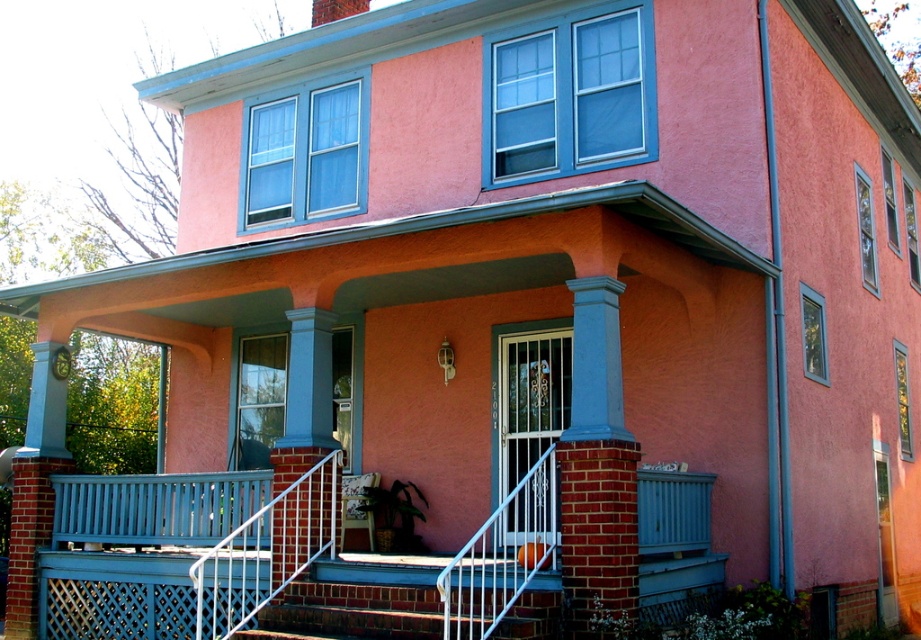
Who is positioned more to the left, blue painted brick column at center or white metal railing at center?

From the viewer's perspective, white metal railing at center appears more on the left side.

Can you confirm if blue painted brick column at center is taller than white metal railing at center?

Yes.

Is point (626, 547) closer to viewer compared to point (461, 604)?

No, (626, 547) is behind (461, 604).

You are a GUI agent. You are given a task and a screenshot of the screen. Output one action in this format:
    pyautogui.click(x=<x>, y=<y>)
    Task: Click on the blue painted brick column at center
    
    Given the screenshot: What is the action you would take?
    pyautogui.click(x=596, y=467)

Can you confirm if white metal railing at center is taller than brick stairs at center?

Indeed, white metal railing at center has a greater height compared to brick stairs at center.

Is white metal railing at center below brick stairs at center?

Actually, white metal railing at center is above brick stairs at center.

Describe the element at coordinates (502, 554) in the screenshot. I see `white metal railing at center` at that location.

Image resolution: width=921 pixels, height=640 pixels. Identify the location of white metal railing at center. (502, 554).

Can you confirm if white metal railing at lower center is positioned above brick stairs at center?

Indeed, white metal railing at lower center is positioned over brick stairs at center.

Is point (239, 627) farther from viewer compared to point (287, 611)?

No, (239, 627) is closer to viewer.

Where is `white metal railing at lower center`? The image size is (921, 640). white metal railing at lower center is located at coordinates (267, 550).